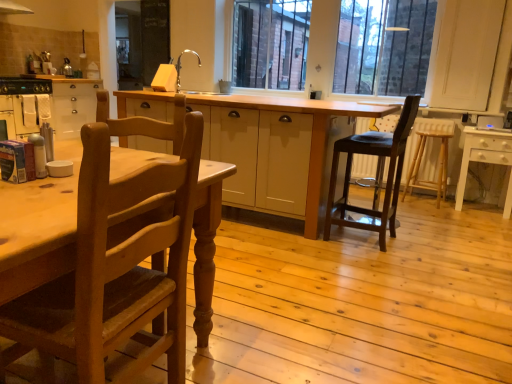
Question: From their relative heights in the image, would you say dark brown wood stool at center-right, which appears as the second chair when viewed from the front, is taller or shorter than white glossy table at right, marked as the 1th table in a right-to-left arrangement?

Choices:
 (A) short
 (B) tall

Answer: (B)

Question: Is dark brown wood stool at center-right, placed as the first chair when sorted from right to left, inside or outside of white glossy table at right, marked as the 1th table in a right-to-left arrangement?

Choices:
 (A) outside
 (B) inside

Answer: (A)

Question: Estimate the real-world distances between objects in this image. Which object is farther from the light wood table at center, which appears as the 2th table when viewed from the right?

Choices:
 (A) light brown wooden bar stool at right
 (B) silver metallic sink at upper center
 (C) white glossy table at right, positioned as the second table in left-to-right order
 (D) white matte cabinet at left
 (E) light brown wood chair at left, which is counted as the 2th chair, starting from the back

Answer: (D)

Question: Estimate the real-world distances between objects in this image. Which object is farther from the white matte cabinet at left?

Choices:
 (A) light brown wooden bar stool at right
 (B) white glossy table at right, positioned as the second table in left-to-right order
 (C) silver metallic sink at upper center
 (D) light brown wood chair at left, which is counted as the 2th chair, starting from the back
 (E) dark brown wood stool at center-right, the second chair from the left

Answer: (B)